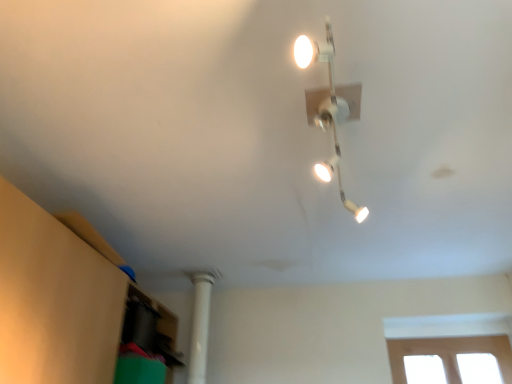
This screenshot has height=384, width=512. Describe the element at coordinates (329, 107) in the screenshot. I see `white glossy track light at upper center` at that location.

Where is `white glossy track light at upper center`? The image size is (512, 384). white glossy track light at upper center is located at coordinates click(x=329, y=107).

What do you see at coordinates (200, 327) in the screenshot?
I see `white smooth column at lower left` at bounding box center [200, 327].

You are a GUI agent. You are given a task and a screenshot of the screen. Output one action in this format:
    pyautogui.click(x=<x>, y=<y>)
    Task: Click on the white smooth column at lower left
    
    Given the screenshot: What is the action you would take?
    pyautogui.click(x=200, y=327)

This screenshot has width=512, height=384. Identify the location of white glossy track light at upper center. pyautogui.click(x=329, y=107).

Looking at this image, considering the positions of objects white glossy track light at upper center and white smooth column at lower left in the image provided, who is more to the right, white glossy track light at upper center or white smooth column at lower left?

From the viewer's perspective, white glossy track light at upper center appears more on the right side.

Does white glossy track light at upper center lie in front of white smooth column at lower left?

Yes, white glossy track light at upper center is closer to the viewer.

Is point (332, 68) in front of point (192, 370)?

Yes, point (332, 68) is in front of point (192, 370).

From the image's perspective, is white glossy track light at upper center located beneath white smooth column at lower left?

Incorrect, from the image's perspective, white glossy track light at upper center is higher than white smooth column at lower left.

From a real-world perspective, which is physically above, white glossy track light at upper center or white smooth column at lower left?

Result: In real-world perspective, white glossy track light at upper center is above.

Based on the photo, looking at their sizes, would you say white glossy track light at upper center is wider or thinner than white smooth column at lower left?

white glossy track light at upper center is wider than white smooth column at lower left.

Is white glossy track light at upper center taller than white smooth column at lower left?

Incorrect, the height of white glossy track light at upper center is not larger of that of white smooth column at lower left.

Between white glossy track light at upper center and white smooth column at lower left, which one has smaller size?

Answer: With smaller size is white smooth column at lower left.

Which is correct: white glossy track light at upper center is inside white smooth column at lower left, or outside of it?

white glossy track light at upper center is not enclosed by white smooth column at lower left.

Is white glossy track light at upper center far from white smooth column at lower left?

Yes, white glossy track light at upper center and white smooth column at lower left are quite far apart.

Consider the image. Could you tell me if white glossy track light at upper center is facing white smooth column at lower left?

No, white glossy track light at upper center is not aimed at white smooth column at lower left.

How many degrees apart are the facing directions of white glossy track light at upper center and white smooth column at lower left?

93.9 degrees.

You are a GUI agent. You are given a task and a screenshot of the screen. Output one action in this format:
    pyautogui.click(x=<x>, y=<y>)
    Task: Click on the pillar on the left side of white glossy track light at upper center
    The width and height of the screenshot is (512, 384).
    Given the screenshot: What is the action you would take?
    pyautogui.click(x=200, y=327)

Considering the relative positions of white smooth column at lower left and white glossy track light at upper center in the image provided, is white smooth column at lower left to the left or to the right of white glossy track light at upper center?

In the image, white smooth column at lower left appears on the left side of white glossy track light at upper center.

Is the position of white smooth column at lower left less distant than that of white glossy track light at upper center?

No, it is not.

Does point (199, 356) come behind point (356, 97)?

Yes, point (199, 356) is behind point (356, 97).

From the image's perspective, is white smooth column at lower left positioned above or below white glossy track light at upper center?

white smooth column at lower left is situated lower than white glossy track light at upper center in the image.

From a real-world perspective, between white smooth column at lower left and white glossy track light at upper center, who is vertically lower?

From a 3D spatial view, white smooth column at lower left is below.

Looking at their sizes, would you say white smooth column at lower left is wider or thinner than white glossy track light at upper center?

Considering their sizes, white smooth column at lower left looks slimmer than white glossy track light at upper center.

Can you confirm if white smooth column at lower left is shorter than white glossy track light at upper center?

No.

Is white smooth column at lower left smaller than white glossy track light at upper center?

Yes, white smooth column at lower left is smaller than white glossy track light at upper center.

Does white smooth column at lower left contain white glossy track light at upper center?

Actually, white glossy track light at upper center is outside white smooth column at lower left.

Are white smooth column at lower left and white glossy track light at upper center beside each other?

No, white smooth column at lower left is not next to white glossy track light at upper center.

Could you tell me if white smooth column at lower left is turned towards white glossy track light at upper center?

No, white smooth column at lower left is not oriented towards white glossy track light at upper center.

Measure the distance between white smooth column at lower left and white glossy track light at upper center.

A distance of 1.27 meters exists between white smooth column at lower left and white glossy track light at upper center.

Image resolution: width=512 pixels, height=384 pixels. In order to click on pillar below the white glossy track light at upper center (from the image's perspective) in this screenshot , I will do `click(200, 327)`.

I want to click on lamp in front of the white smooth column at lower left, so click(x=329, y=107).

At what (x,y) coordinates should I click in order to perform the action: click on pillar behind the white glossy track light at upper center. Please return your answer as a coordinate pair (x, y). The image size is (512, 384). Looking at the image, I should click on (200, 327).